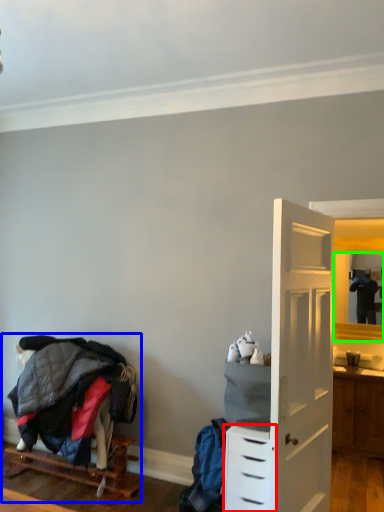
Question: Based on their relative distances, which object is farther from chest of drawers (highlighted by a red box)? Choose from bunk bed (highlighted by a blue box) and mirror (highlighted by a green box).

Choices:
 (A) bunk bed
 (B) mirror

Answer: (B)